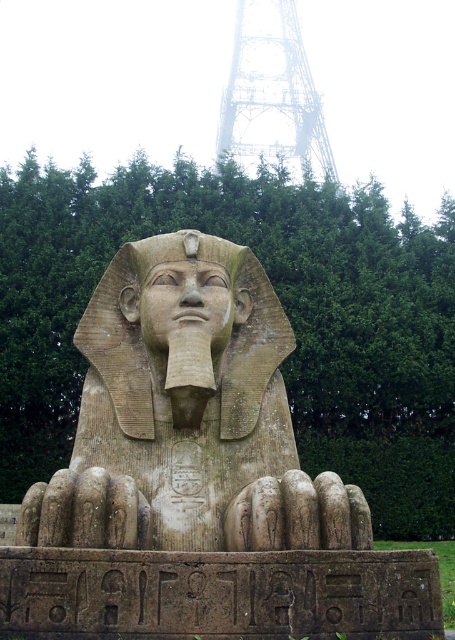
This screenshot has height=640, width=455. In order to click on stone statue at center in this screenshot , I will do `click(187, 417)`.

Which of these two, stone statue at center or stone statue head at center, stands taller?

Standing taller between the two is stone statue at center.

Is point (111, 342) positioned after point (212, 300)?

That is True.

What are the coordinates of `stone statue at center` in the screenshot? It's located at pyautogui.click(x=187, y=417).

Does metallic lattice structure at upper center appear over matte stone nose at center?

Yes, metallic lattice structure at upper center is above matte stone nose at center.

Between point (237, 22) and point (183, 300), which one is positioned in front?

Point (183, 300)

Does point (293, 12) come in front of point (186, 300)?

No, (293, 12) is behind (186, 300).

Locate an element on the screen. The width and height of the screenshot is (455, 640). metallic lattice structure at upper center is located at coordinates (273, 96).

Is stone statue at center closer to the viewer compared to matte stone nose at center?

Yes, it is in front of matte stone nose at center.

Locate an element on the screen. This screenshot has height=640, width=455. stone statue at center is located at coordinates (187, 417).

Locate an element on the screen. Image resolution: width=455 pixels, height=640 pixels. stone statue at center is located at coordinates (187, 417).